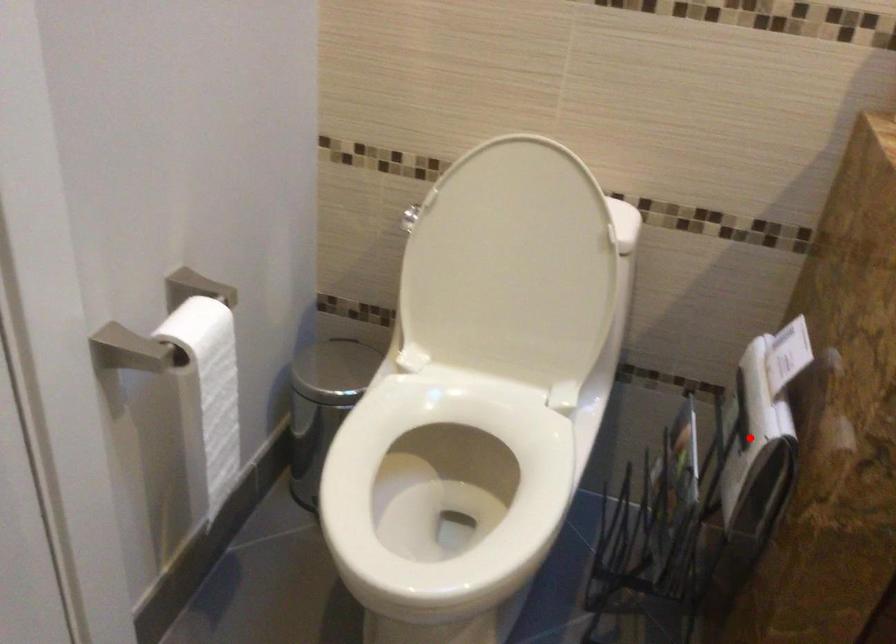
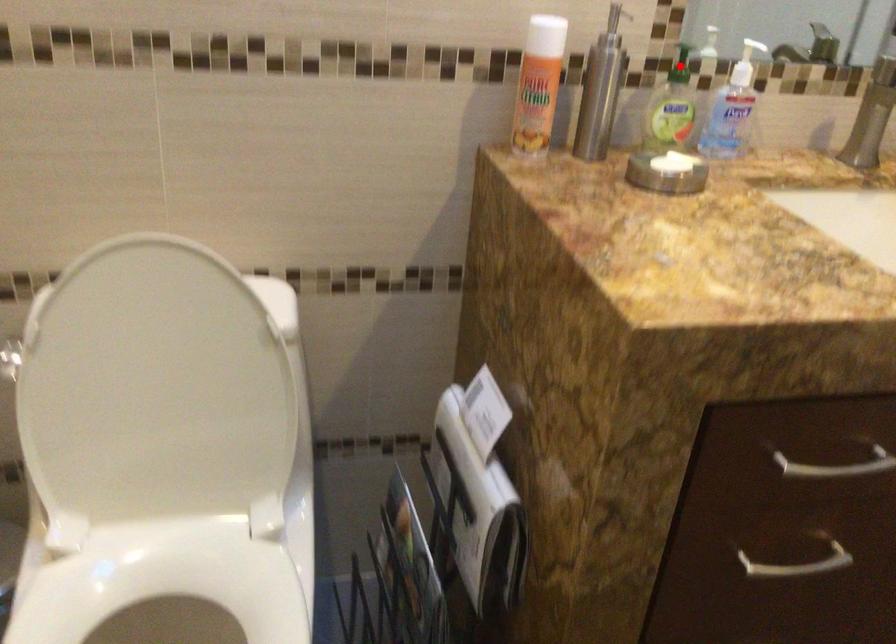
I am providing you with two images of the same scene from different viewpoints. A red point is marked on the first image and another point is marked on the second image. Do the highlighted points in image1 and image2 indicate the same real-world spot?

No